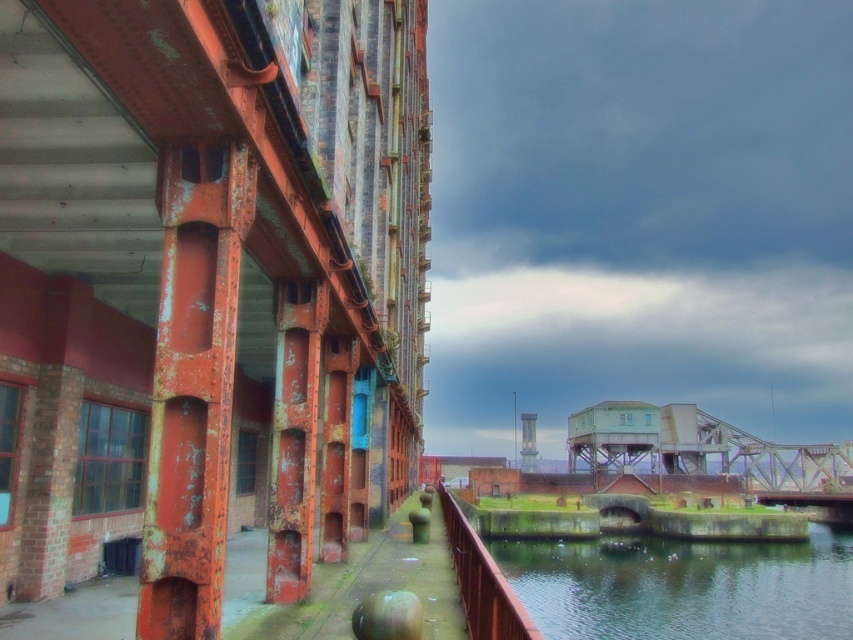
Question: Can you confirm if rustic metal bridge at center is wider than rusty metal rail at lower center?

Choices:
 (A) no
 (B) yes

Answer: (B)

Question: Considering the real-world distances, which object is closest to the rusty metal rail at lower center?

Choices:
 (A) clear water at lower right
 (B) rustic metal bridge at center

Answer: (A)

Question: Is the position of rustic metal bridge at center more distant than that of rusty metal rail at lower center?

Choices:
 (A) yes
 (B) no

Answer: (A)

Question: Which object appears farthest from the camera in this image?

Choices:
 (A) rustic metal bridge at center
 (B) clear water at lower right
 (C) rusty metal rail at lower center

Answer: (A)

Question: Which of the following is the closest to the observer?

Choices:
 (A) tap(544, 550)
 (B) tap(634, 426)

Answer: (A)

Question: Is clear water at lower right wider than rusty metal rail at lower center?

Choices:
 (A) yes
 (B) no

Answer: (A)